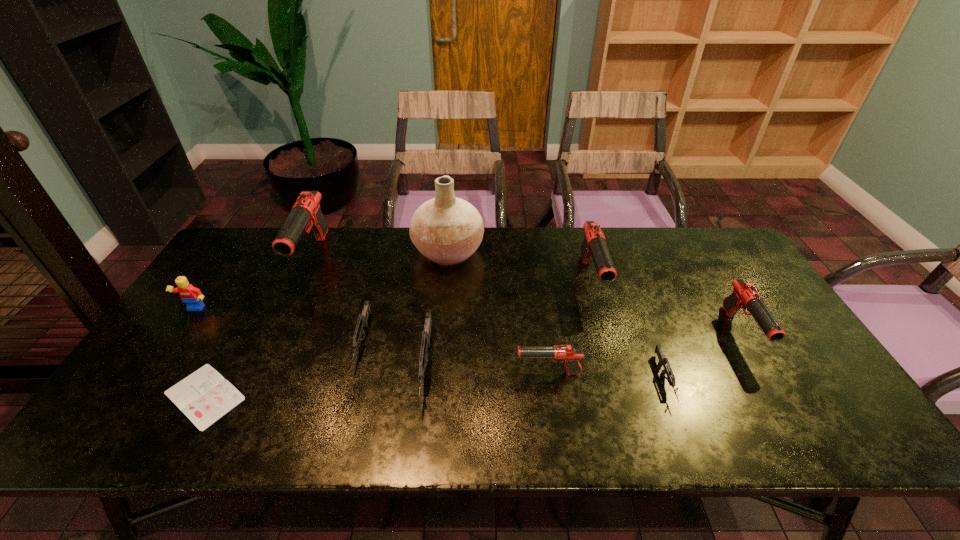
This screenshot has width=960, height=540. I want to click on pottery, so click(447, 230).

I want to click on the tallest object, so click(x=447, y=230).

The height and width of the screenshot is (540, 960). What are the coordinates of `the second tallest object` in the screenshot? It's located at (306, 212).

The image size is (960, 540). Identify the location of the biggest black gun. (306, 212).

You are a GUI agent. You are given a task and a screenshot of the screen. Output one action in this format:
    pyautogui.click(x=<x>, y=<y>)
    Task: Click on the third black gun from left to right
    Image resolution: width=960 pixels, height=540 pixels.
    Given the screenshot: What is the action you would take?
    [x=594, y=244]

Identify the location of the second biggest black gun. The width and height of the screenshot is (960, 540). (594, 244).

Image resolution: width=960 pixels, height=540 pixels. Find the location of `the third biggest black gun`. the third biggest black gun is located at coordinates (745, 295).

Image resolution: width=960 pixels, height=540 pixels. I want to click on the rightmost black gun, so click(745, 295).

At what (x,y) coordinates should I click in order to perform the action: click on yellow Lego. Please return your answer as a coordinate pair (x, y). Looking at the image, I should click on (192, 296).

This screenshot has width=960, height=540. I want to click on Lego, so click(192, 296).